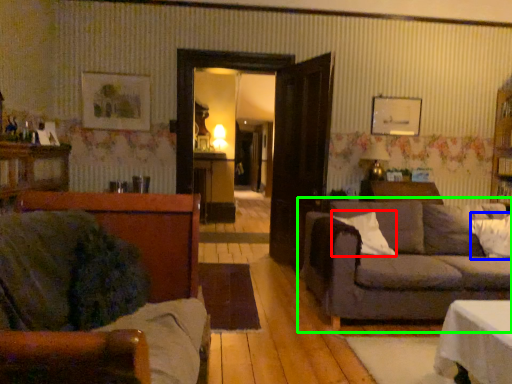
Question: Considering the real-world distances, which object is farthest from pillow (highlighted by a red box)? pillow (highlighted by a blue box) or studio couch (highlighted by a green box)?

Choices:
 (A) pillow
 (B) studio couch

Answer: (A)